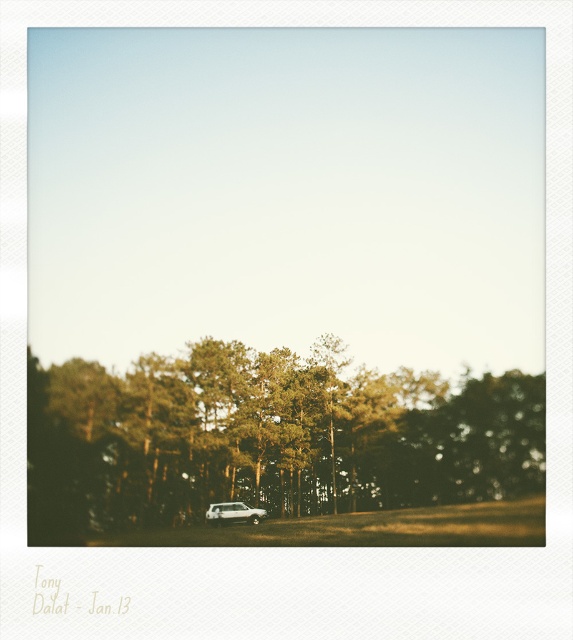
You are standing in the grassy area in front of the parked white SUV. There are two points marked in the scene. Which point is closer to you, point (473, 449) or point (221, 518)?

Point (473, 449) is closer to you because it is further to the viewer than point (221, 518).

Consider the image. You are a driver trying to park your car in the parking lot. You see the green matte tree at center and the white matte suv at center. Which object is wider?

The green matte tree at center is wider than the white matte suv at center according to the description.

You are standing at the origin point of the coordinate system in this image. The origin is at the bottom left corner of the image. You want to walk towards the green matte tree at center. In which direction should you move relative to the current position?

The green matte tree at center is located at coordinate point 0.686 on the x axis and 0.466 on the y axis. Since the origin is at the bottom left corner, moving towards higher x values means moving to the right, and higher y values mean moving upwards. Therefore, to reach the green matte tree at center, you should move to the right and upwards from your current position at the origin.